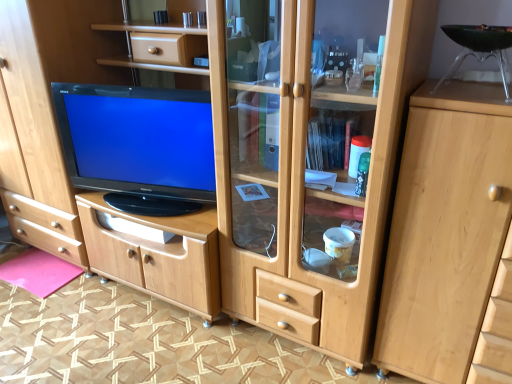
This screenshot has width=512, height=384. I want to click on black glossy television at center, so click(x=138, y=140).

Locate an element on the screen. This screenshot has height=384, width=512. light wood cabinet at right is located at coordinates (445, 231).

From a real-world perspective, between light wood cabinet at right and black glossy television at center, who is vertically higher?

From a 3D spatial view, black glossy television at center is above.

Does point (420, 90) lie in front of point (176, 159)?

Yes, it is.

In terms of size, does light wood cabinet at right appear bigger or smaller than black glossy television at center?

In the image, light wood cabinet at right appears to be larger than black glossy television at center.

Locate an element on the screen. This screenshot has height=384, width=512. television above the light wood cabinet at right (from the image's perspective) is located at coordinates (138, 140).

Is black glossy television at center not within light wood cabinet at right?

Yes, black glossy television at center is outside of light wood cabinet at right.

Based on their sizes in the image, would you say black glossy television at center is bigger or smaller than light wood cabinet at right?

Considering their sizes, black glossy television at center takes up less space than light wood cabinet at right.

From the image's perspective, is black glossy television at center positioned above or below light wood cabinet at right?

black glossy television at center is situated higher than light wood cabinet at right in the image.

Considering the sizes of objects pink felt mat at lower left and black glossy television at center in the image provided, who is shorter, pink felt mat at lower left or black glossy television at center?

pink felt mat at lower left.

Measure the distance from pink felt mat at lower left to black glossy television at center.

They are 86.14 centimeters apart.

Consider the image. Does pink felt mat at lower left have a lesser width compared to black glossy television at center?

No, pink felt mat at lower left is not thinner than black glossy television at center.

Considering the sizes of objects pink felt mat at lower left and black glossy television at center in the image provided, who is smaller, pink felt mat at lower left or black glossy television at center?

pink felt mat at lower left is smaller.

Which object is positioned more to the left, light wood cabinet at right or pink felt mat at lower left?

pink felt mat at lower left.

Where is `cabinetry in front of the pink felt mat at lower left`? Image resolution: width=512 pixels, height=384 pixels. cabinetry in front of the pink felt mat at lower left is located at coordinates (445, 231).

From the image's perspective, is light wood cabinet at right located beneath pink felt mat at lower left?

No.

Is light wood cabinet at right inside the boundaries of pink felt mat at lower left, or outside?

The correct answer is: outside.

From a real-world perspective, is black glossy television at center under pink felt mat at lower left?

Incorrect, from a real-world perspective, black glossy television at center is higher than pink felt mat at lower left.

Is black glossy television at center aimed at pink felt mat at lower left?

No, black glossy television at center is not facing towards pink felt mat at lower left.

Considering the points (106, 148) and (61, 266), which point is in front, point (106, 148) or point (61, 266)?

The point (106, 148) is more forward.

Can you confirm if black glossy television at center is taller than pink felt mat at lower left?

Yes, black glossy television at center is taller than pink felt mat at lower left.

Which of these two, pink felt mat at lower left or light wood cabinet at right, is thinner?

With smaller width is pink felt mat at lower left.

Relative to light wood cabinet at right, is pink felt mat at lower left in front or behind?

In the image, pink felt mat at lower left appears behind light wood cabinet at right.

Considering the positions of point (25, 262) and point (481, 180), is point (25, 262) closer or farther from the camera than point (481, 180)?

Point (25, 262).

Is pink felt mat at lower left positioned with its back to light wood cabinet at right?

pink felt mat at lower left is not turned away from light wood cabinet at right.

I want to click on television located on the left of light wood cabinet at right, so click(x=138, y=140).

Where is `cabinetry below the black glossy television at center (from the image's perspective)`? The height and width of the screenshot is (384, 512). cabinetry below the black glossy television at center (from the image's perspective) is located at coordinates (445, 231).

Estimate the real-world distances between objects in this image. Which object is further from light wood cabinet at right, black glossy television at center or pink felt mat at lower left?

Among the two, pink felt mat at lower left is located further to light wood cabinet at right.

Estimate the real-world distances between objects in this image. Which object is further from pink felt mat at lower left, black glossy television at center or light wood cabinet at right?

Based on the image, light wood cabinet at right appears to be further to pink felt mat at lower left.

Which object lies nearer to the anchor point light wood cabinet at right, pink felt mat at lower left or black glossy television at center?

Based on the image, black glossy television at center appears to be nearer to light wood cabinet at right.

When comparing their distances from black glossy television at center, does light wood cabinet at right or pink felt mat at lower left seem closer?

pink felt mat at lower left.

From the picture: Estimate the real-world distances between objects in this image. Which object is closer to black glossy television at center, pink felt mat at lower left or light wood cabinet at right?

Based on the image, pink felt mat at lower left appears to be nearer to black glossy television at center.

Considering their positions, is light wood cabinet at right positioned further to pink felt mat at lower left than black glossy television at center?

light wood cabinet at right is positioned further to the anchor pink felt mat at lower left.

Identify the location of television between pink felt mat at lower left and light wood cabinet at right from left to right. (138, 140).